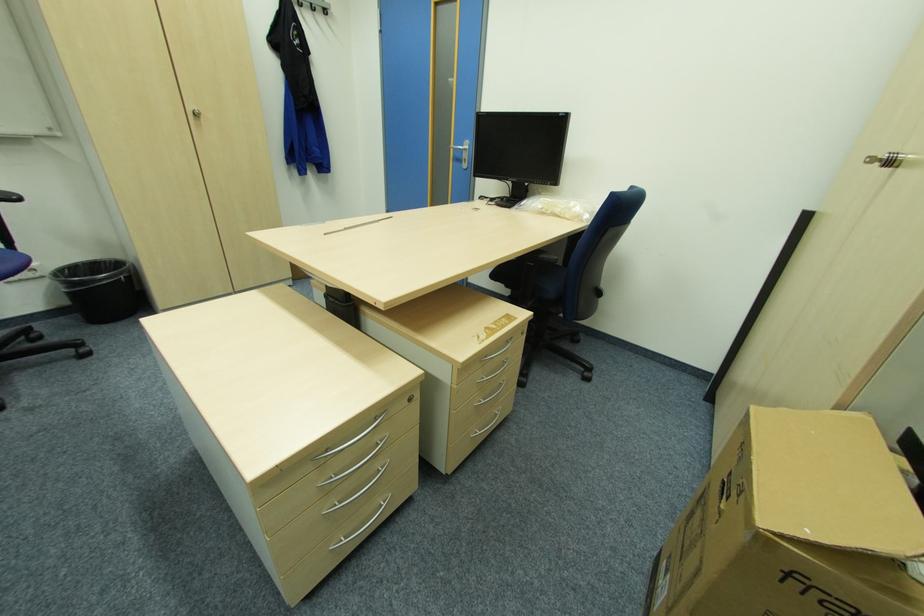
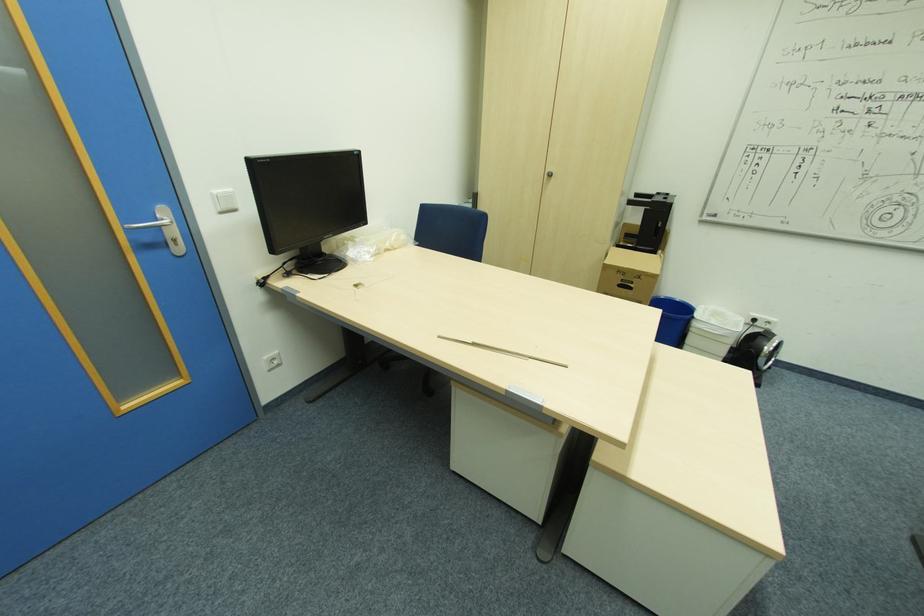
The point at (891, 161) is marked in the first image. Where is the corresponding point in the second image?

(553, 175)